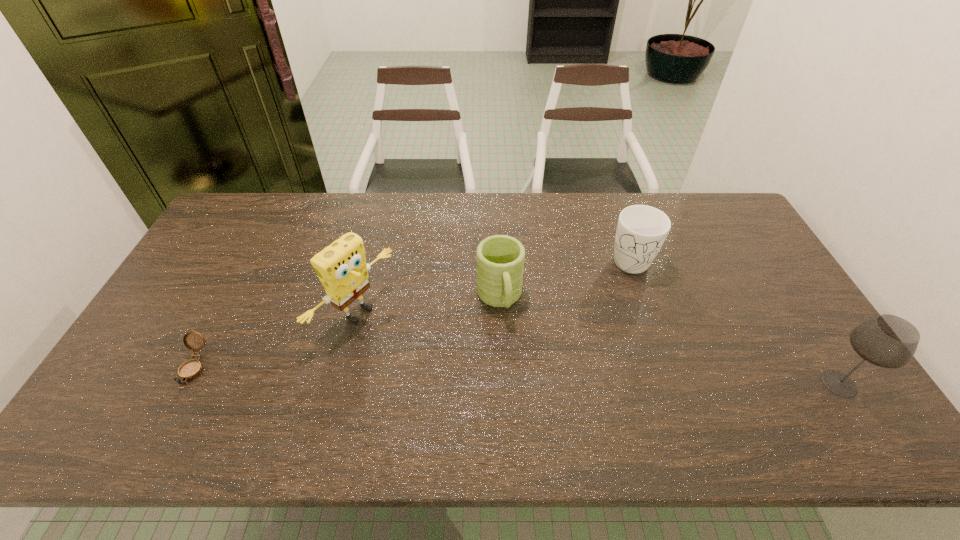
The image size is (960, 540). I want to click on free point located 0.350m on the face of the fourth object from right to left, so click(487, 402).

The height and width of the screenshot is (540, 960). In order to click on blank space located on the face of the fourth object from right to left in this screenshot , I will do `click(444, 375)`.

Find the location of `free spot located on the face of the fourth object from right to left`. free spot located on the face of the fourth object from right to left is located at coordinates (397, 345).

This screenshot has width=960, height=540. In order to click on vacant point located 0.350m on the side of the second object from right to left with the handle in this screenshot , I will do `click(561, 347)`.

This screenshot has width=960, height=540. What are the coordinates of `vacant point located 0.390m on the side of the second object from right to left with the handle` in the screenshot? It's located at (553, 357).

The height and width of the screenshot is (540, 960). Identify the location of free space located on the side of the second object from right to left with the handle. (570, 335).

Where is `compass situated at the near edge`? compass situated at the near edge is located at coordinates (191, 369).

Where is `wineglass at the near edge`? The height and width of the screenshot is (540, 960). wineglass at the near edge is located at coordinates (888, 341).

Identify the location of object at the left edge. (191, 369).

You are a GUI agent. You are given a task and a screenshot of the screen. Output one action in this format:
    pyautogui.click(x=<x>, y=<y>)
    Task: Click on the object at the right edge
    The width and height of the screenshot is (960, 540).
    Given the screenshot: What is the action you would take?
    pyautogui.click(x=888, y=341)